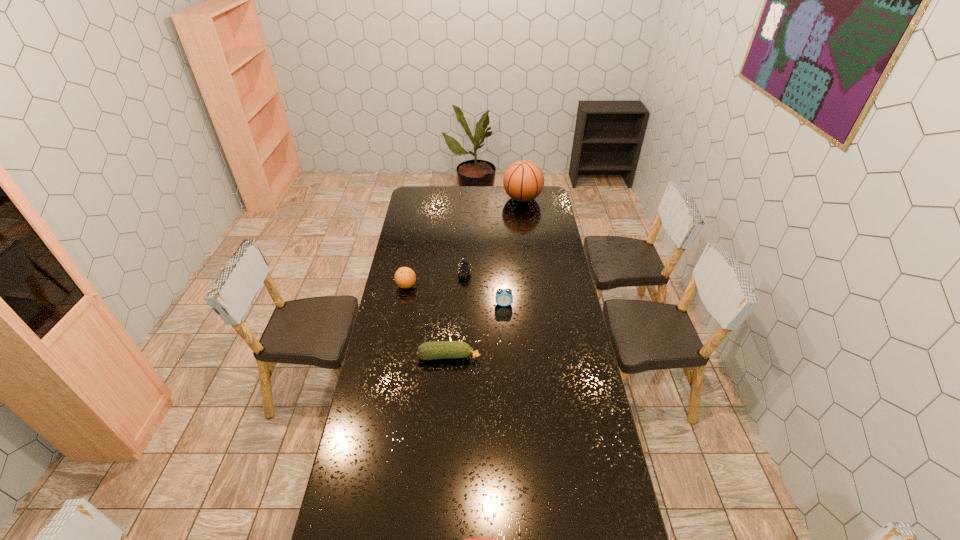
Locate an element on the screen. This screenshot has height=540, width=960. blank space located on the right of the third farthest object is located at coordinates (449, 286).

The width and height of the screenshot is (960, 540). In order to click on free spot located on the left of the pinecone in this screenshot , I will do `click(398, 273)`.

Where is `vacant space situated on the face of the third nearest object`? The image size is (960, 540). vacant space situated on the face of the third nearest object is located at coordinates (506, 343).

Find the location of `free spot located at the blossom end of the cucumber`. free spot located at the blossom end of the cucumber is located at coordinates (558, 357).

I want to click on object that is at the far edge, so click(523, 181).

Find the location of a particular element. object at the left edge is located at coordinates (405, 277).

This screenshot has width=960, height=540. In order to click on object present at the right edge in this screenshot , I will do `click(523, 181)`.

Where is `object positioned at the far right corner`? The image size is (960, 540). object positioned at the far right corner is located at coordinates (523, 181).

In the image, there is a desktop. Find the location of `vacant region at the left edge`. vacant region at the left edge is located at coordinates (400, 231).

The width and height of the screenshot is (960, 540). I want to click on vacant area at the right edge, so click(x=587, y=494).